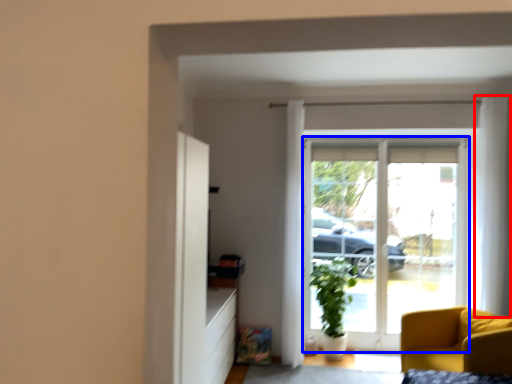
Question: Which of the following is the farthest to the observer, curtain (highlighted by a red box) or door (highlighted by a blue box)?

Choices:
 (A) curtain
 (B) door

Answer: (B)